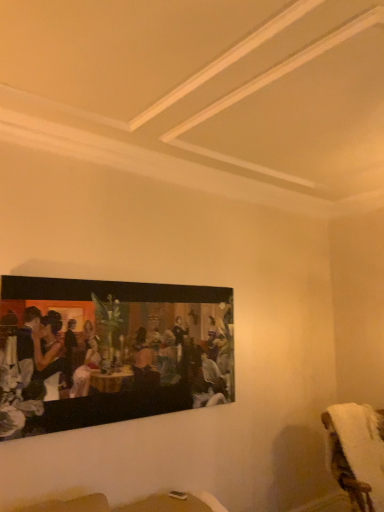
Identify the location of white fluffy towel at lower right. (346, 470).

The height and width of the screenshot is (512, 384). Describe the element at coordinates (346, 470) in the screenshot. I see `white fluffy towel at lower right` at that location.

The width and height of the screenshot is (384, 512). I want to click on matte black painting at upper left, so click(x=109, y=352).

Measure the distance between point (x=53, y=310) and camera.

The distance of point (x=53, y=310) from camera is 2.41 meters.

Image resolution: width=384 pixels, height=512 pixels. Describe the element at coordinates (109, 352) in the screenshot. I see `matte black painting at upper left` at that location.

Identify the location of white fluffy towel at lower right. [x=346, y=470].

Considering the positions of objects white fluffy towel at lower right and matte black painting at upper left in the image provided, who is more to the left, white fluffy towel at lower right or matte black painting at upper left?

From the viewer's perspective, matte black painting at upper left appears more on the left side.

Considering their positions, is white fluffy towel at lower right located in front of or behind matte black painting at upper left?

Visually, white fluffy towel at lower right is located behind matte black painting at upper left.

Considering the positions of point (330, 420) and point (206, 291), is point (330, 420) closer or farther from the camera than point (206, 291)?

Point (330, 420) appears to be farther away from the viewer than point (206, 291).

From the image's perspective, is white fluffy towel at lower right over matte black painting at upper left?

No, from the image's perspective, white fluffy towel at lower right is not over matte black painting at upper left.

From a real-world perspective, who is located higher, white fluffy towel at lower right or matte black painting at upper left?

matte black painting at upper left, from a real-world perspective.

Considering the relative sizes of white fluffy towel at lower right and matte black painting at upper left in the image provided, is white fluffy towel at lower right thinner than matte black painting at upper left?

No.

Can you confirm if white fluffy towel at lower right is shorter than matte black painting at upper left?

Indeed, white fluffy towel at lower right has a lesser height compared to matte black painting at upper left.

Which of these two, white fluffy towel at lower right or matte black painting at upper left, is smaller?

matte black painting at upper left is smaller.

Would you say white fluffy towel at lower right contains matte black painting at upper left?

No.

Are white fluffy towel at lower right and matte black painting at upper left far apart?

Absolutely, white fluffy towel at lower right is distant from matte black painting at upper left.

Is white fluffy towel at lower right oriented away from matte black painting at upper left?

That's not correct — white fluffy towel at lower right is not looking away from matte black painting at upper left.

Measure the distance from white fluffy towel at lower right to matte black painting at upper left.

white fluffy towel at lower right is 5.30 feet away from matte black painting at upper left.

Locate an element on the screen. The image size is (384, 512). picture frame in front of the white fluffy towel at lower right is located at coordinates (109, 352).

Would you say matte black painting at upper left is to the left or to the right of white fluffy towel at lower right in the picture?

In the image, matte black painting at upper left appears on the left side of white fluffy towel at lower right.

Which is in front, matte black painting at upper left or white fluffy towel at lower right?

Positioned in front is matte black painting at upper left.

Does point (80, 402) appear closer or farther from the camera than point (368, 408)?

Point (80, 402) is closer to the camera than point (368, 408).

From the image's perspective, would you say matte black painting at upper left is positioned over white fluffy towel at lower right?

Yes, from the image's perspective, matte black painting at upper left is on top of white fluffy towel at lower right.

In the scene shown: From a real-world perspective, which object rests below the other?

white fluffy towel at lower right is physically lower.

Considering the relative sizes of matte black painting at upper left and white fluffy towel at lower right in the image provided, is matte black painting at upper left thinner than white fluffy towel at lower right?

Correct, the width of matte black painting at upper left is less than that of white fluffy towel at lower right.

Can you confirm if matte black painting at upper left is taller than white fluffy towel at lower right?

Yes, matte black painting at upper left is taller than white fluffy towel at lower right.

Between matte black painting at upper left and white fluffy towel at lower right, which one has larger size?

white fluffy towel at lower right.

Is matte black painting at upper left located outside white fluffy towel at lower right?

matte black painting at upper left is positioned outside white fluffy towel at lower right.

Is matte black painting at upper left next to white fluffy towel at lower right?

No.

Is matte black painting at upper left oriented away from white fluffy towel at lower right?

That's not correct — matte black painting at upper left is not looking away from white fluffy towel at lower right.

Identify the location of furniture on the right of matte black painting at upper left. Image resolution: width=384 pixels, height=512 pixels. (346, 470).

I want to click on furniture that is behind the matte black painting at upper left, so click(x=346, y=470).

You are a GUI agent. You are given a task and a screenshot of the screen. Output one action in this format:
    pyautogui.click(x=<x>, y=<y>)
    Task: Click on the furniture to the right of matte black painting at upper left
    The image size is (384, 512).
    Given the screenshot: What is the action you would take?
    pyautogui.click(x=346, y=470)